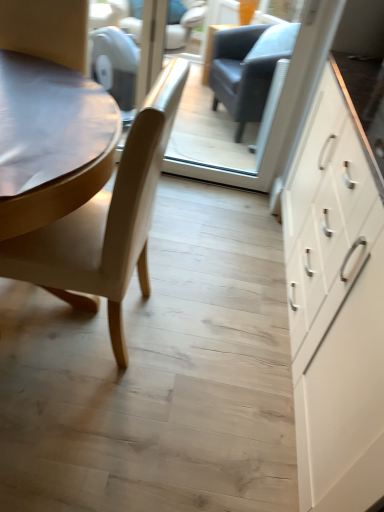
The width and height of the screenshot is (384, 512). I want to click on transparent glass door at center, so click(x=295, y=79).

The width and height of the screenshot is (384, 512). I want to click on transparent glass door at center, so click(295, 79).

Measure the distance from light beige leather chair at left to white matte cabinet at right.

The distance of light beige leather chair at left from white matte cabinet at right is 25.69 inches.

From the image's perspective, who appears lower, light beige leather chair at left or white matte cabinet at right?

white matte cabinet at right, from the image's perspective.

From a real-world perspective, who is located higher, light beige leather chair at left or white matte cabinet at right?

white matte cabinet at right is physically above.

Is light beige leather chair at left not close to white matte cabinet at right?

Actually, light beige leather chair at left and white matte cabinet at right are a little close together.

Which of these two, white matte cabinet at right or light beige leather chair at left, is bigger?

white matte cabinet at right.

Is white matte cabinet at right with light beige leather chair at left?

No, white matte cabinet at right is not beside light beige leather chair at left.

From a real-world perspective, is white matte cabinet at right under light beige leather chair at left?

No, from a real-world perspective, white matte cabinet at right is not below light beige leather chair at left.

Is light beige leather chair at left at the back of white matte cabinet at right?

That's right, white matte cabinet at right is facing away from light beige leather chair at left.

From the image's perspective, between transparent glass door at center and light beige leather chair at left, which one is located above?

transparent glass door at center is shown above in the image.

From a real-world perspective, is transparent glass door at center on light beige leather chair at left?

Yes, from a real-world perspective, transparent glass door at center is on top of light beige leather chair at left.

Is transparent glass door at center completely or partially outside of light beige leather chair at left?

transparent glass door at center is positioned outside light beige leather chair at left.

Does transparent glass door at center appear on the left side of light beige leather chair at left?

No, transparent glass door at center is not to the left of light beige leather chair at left.

Which is more to the right, light beige leather chair at left or transparent glass door at center?

From the viewer's perspective, transparent glass door at center appears more on the right side.

Consider the image. From the image's perspective, which is below, light beige leather chair at left or transparent glass door at center?

light beige leather chair at left, from the image's perspective.

Considering the relative sizes of light beige leather chair at left and transparent glass door at center in the image provided, is light beige leather chair at left wider than transparent glass door at center?

Yes.

What's the angular difference between transparent glass door at center and white matte cabinet at right's facing directions?

transparent glass door at center and white matte cabinet at right are facing 89 degrees away from each other.

From a real-world perspective, is transparent glass door at center physically located above or below white matte cabinet at right?

transparent glass door at center is situated lower than white matte cabinet at right in the real world.

Looking at their sizes, would you say transparent glass door at center is wider or thinner than white matte cabinet at right?

transparent glass door at center is thinner than white matte cabinet at right.

Based on the photo, is transparent glass door at center facing towards white matte cabinet at right?

Yes.

From a real-world perspective, which object stands above the other?

white matte cabinet at right is physically above.

Is white matte cabinet at right completely or partially outside of transparent glass door at center?

Indeed, white matte cabinet at right is completely outside transparent glass door at center.

You are a GUI agent. You are given a task and a screenshot of the screen. Output one action in this format:
    pyautogui.click(x=<x>, y=<y>)
    Task: Click on the cabinetry below the transparent glass door at center (from the image's perspective)
    Image resolution: width=384 pixels, height=512 pixels.
    Given the screenshot: What is the action you would take?
    pyautogui.click(x=336, y=304)

Is white matte cabinet at right positioned in front of transparent glass door at center?

Yes, white matte cabinet at right is in front of transparent glass door at center.

The image size is (384, 512). I want to click on cabinetry on the right of light beige leather chair at left, so click(336, 304).

You are a GUI agent. You are given a task and a screenshot of the screen. Output one action in this format:
    pyautogui.click(x=<x>, y=<y>)
    Task: Click on the chair behind the white matte cabinet at right
    This screenshot has height=512, width=384.
    Given the screenshot: What is the action you would take?
    pyautogui.click(x=106, y=222)

Looking at the image, which one is located further to transparent glass door at center, light beige leather chair at left or white matte cabinet at right?

The object further to transparent glass door at center is light beige leather chair at left.

Estimate the real-world distances between objects in this image. Which object is closer to light beige leather chair at left, white matte cabinet at right or transparent glass door at center?

Among the two, white matte cabinet at right is located nearer to light beige leather chair at left.

From the image, which object appears to be farther from white matte cabinet at right, light beige leather chair at left or transparent glass door at center?

transparent glass door at center is positioned further to the anchor white matte cabinet at right.

When comparing their distances from light beige leather chair at left, does transparent glass door at center or white matte cabinet at right seem closer?

Among the two, white matte cabinet at right is located nearer to light beige leather chair at left.

From the image, which object appears to be nearer to transparent glass door at center, white matte cabinet at right or light beige leather chair at left?

Based on the image, white matte cabinet at right appears to be nearer to transparent glass door at center.

From the image, which object appears to be farther from white matte cabinet at right, transparent glass door at center or light beige leather chair at left?

Among the two, transparent glass door at center is located further to white matte cabinet at right.

You are a GUI agent. You are given a task and a screenshot of the screen. Output one action in this format:
    pyautogui.click(x=<x>, y=<y>)
    Task: Click on the chair between white matte cabinet at right and transparent glass door at center from front to back
    The image size is (384, 512).
    Given the screenshot: What is the action you would take?
    click(106, 222)